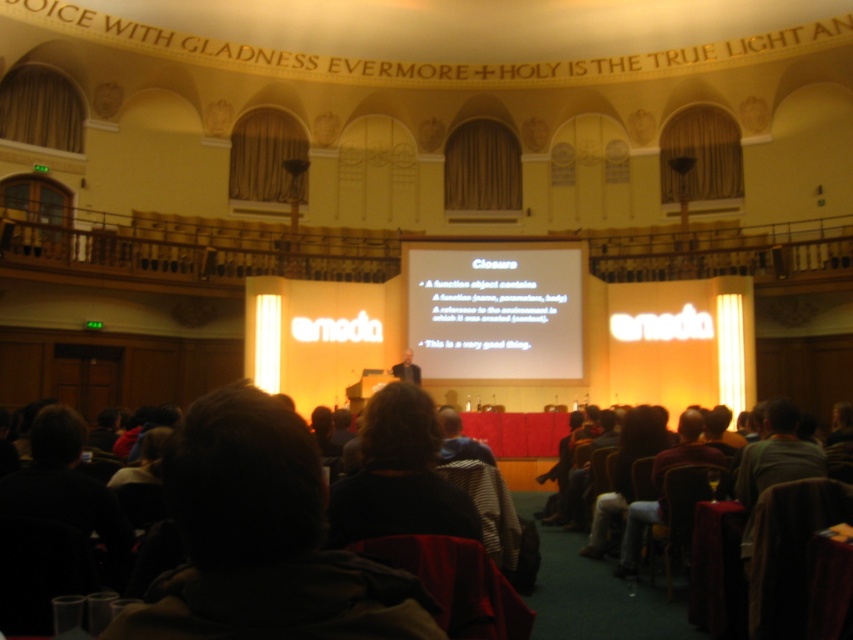
You are an attendee sitting in the front row of the auditorium. You notice the presenter in a matte black suit at center and the white matte projection screen at center. From your perspective, which object is positioned to the right of the other?

The white matte projection screen at center is to the right of the matte black suit at center.

You are attending a presentation in the auditorium and notice the white matte projection screen at center and the matte black suit at center. Which object is positioned higher in the image?

The white matte projection screen at center is located above the matte black suit at center, so it is positioned higher in the image.